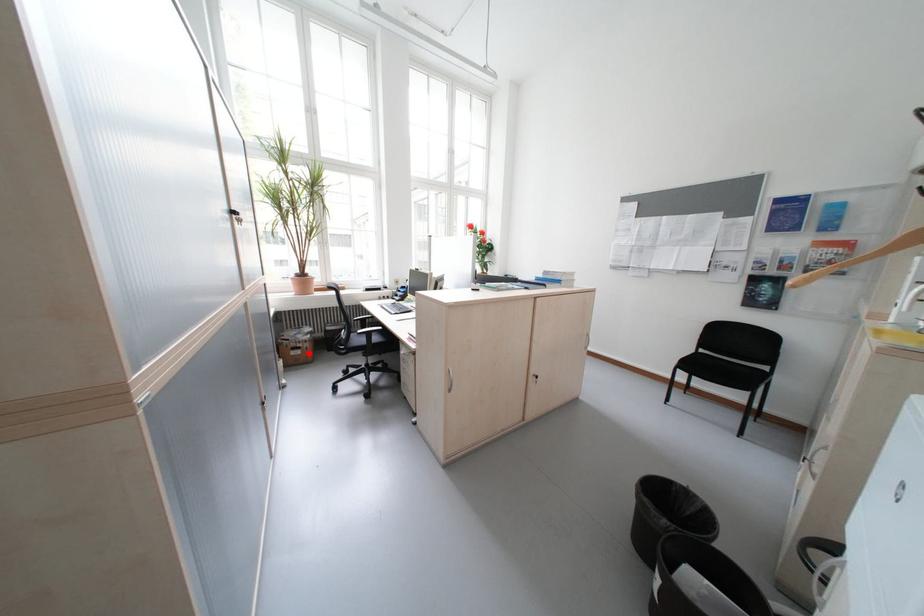
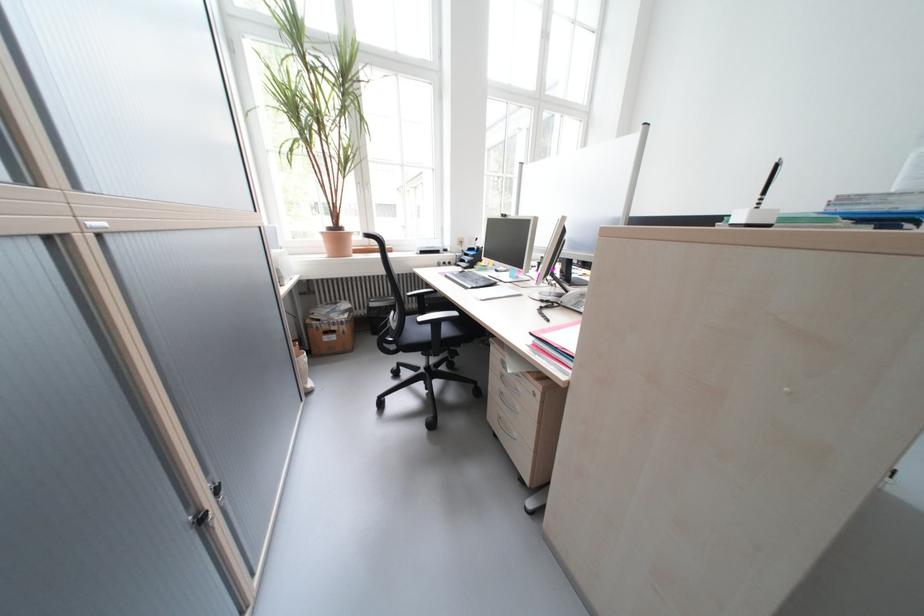
Question: A red point is marked in image1. In image2, is the corresponding 3D point closer to the camera or farther? Reply with the corresponding letter.

Choices:
 (A) The corresponding 3D point is closer.
 (B) The corresponding 3D point is farther.

Answer: (A)